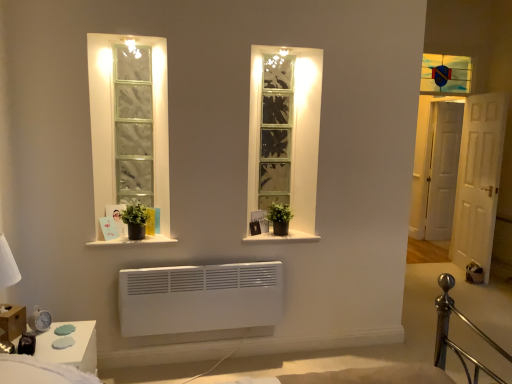
Question: From the image's perspective, would you say white glossy window sill at center, which appears as the 1th window sill when viewed from the right, is shown under green matte plant at center?

Choices:
 (A) no
 (B) yes

Answer: (B)

Question: Is white glossy window sill at center, acting as the 2th window sill starting from the left, directly adjacent to green matte plant at center?

Choices:
 (A) yes
 (B) no

Answer: (B)

Question: From a real-world perspective, is white glossy window sill at center, which appears as the 1th window sill when viewed from the right, positioned over green matte plant at center based on gravity?

Choices:
 (A) yes
 (B) no

Answer: (B)

Question: From the image's perspective, is white glossy window sill at center, which appears as the 1th window sill when viewed from the right, located above green matte plant at center?

Choices:
 (A) no
 (B) yes

Answer: (A)

Question: From a real-world perspective, is white glossy window sill at center, which appears as the 1th window sill when viewed from the right, beneath green matte plant at center?

Choices:
 (A) yes
 (B) no

Answer: (A)

Question: In terms of width, does white glossy window sill at center, acting as the 2th window sill starting from the left, look wider or thinner when compared to stained glass window at upper right?

Choices:
 (A) wide
 (B) thin

Answer: (A)

Question: From the image's perspective, is white glossy window sill at center, which appears as the 1th window sill when viewed from the right, located above or below stained glass window at upper right?

Choices:
 (A) below
 (B) above

Answer: (A)

Question: Do you think white glossy window sill at center, which appears as the 1th window sill when viewed from the right, is within stained glass window at upper right, or outside of it?

Choices:
 (A) inside
 (B) outside

Answer: (B)

Question: Is point (314, 238) positioned closer to the camera than point (459, 77)?

Choices:
 (A) farther
 (B) closer

Answer: (B)

Question: Is point (69, 354) closer or farther from the camera than point (304, 236)?

Choices:
 (A) closer
 (B) farther

Answer: (A)

Question: Is white glossy side table at lower left wider or thinner than white glossy window sill at center, which appears as the 1th window sill when viewed from the right?

Choices:
 (A) thin
 (B) wide

Answer: (B)

Question: Based on their positions, is white glossy side table at lower left located to the left or right of white glossy window sill at center, acting as the 2th window sill starting from the left?

Choices:
 (A) left
 (B) right

Answer: (A)

Question: Considering the positions of white glossy side table at lower left and white glossy window sill at center, acting as the 2th window sill starting from the left, in the image, is white glossy side table at lower left taller or shorter than white glossy window sill at center, acting as the 2th window sill starting from the left,?

Choices:
 (A) short
 (B) tall

Answer: (B)

Question: Relative to white wooden door at right, arranged as the 1th door when viewed from the left, is stained glass window at upper right in front or behind?

Choices:
 (A) front
 (B) behind

Answer: (B)

Question: Would you say stained glass window at upper right is inside or outside white wooden door at right, the second door from the right?

Choices:
 (A) inside
 (B) outside

Answer: (B)